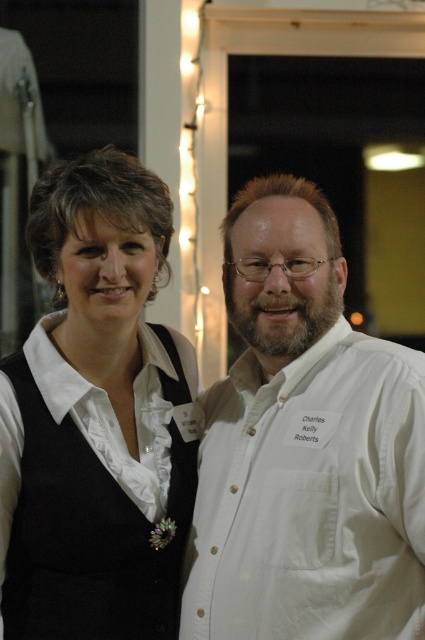
You are a photographer setting up for a group photo. You notice the white cotton shirt at center and the white matte vest at center. Which one is positioned more to the right side?

The white cotton shirt at center is positioned more to the right side than the white matte vest at center.

In the scene shown: You are a photographer trying to capture a closeup of the person whose name tag is partially visible. You are currently focusing on the point at (x=391, y=456). Is this point closer to the camera than the point at (x=48, y=609)?

Yes, the point at (x=391, y=456) is closer to the camera than the point at (x=48, y=609), so focusing on it will give a better closeup.